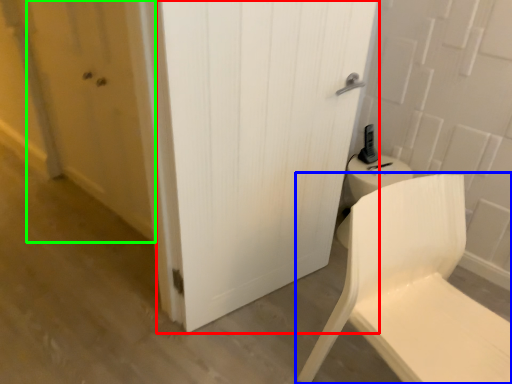
Question: Which object is the closest to the door (highlighted by a red box)? Choose among these: chair (highlighted by a blue box) or screen door (highlighted by a green box).

Choices:
 (A) chair
 (B) screen door

Answer: (A)